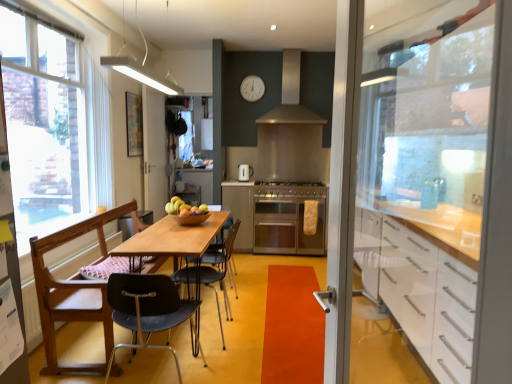
Question: From a real-world perspective, is transparent glass screen door at center, the 2th screen door in the front-to-back sequence, on clear glass window at left?

Choices:
 (A) no
 (B) yes

Answer: (A)

Question: From the image's perspective, is transparent glass screen door at center, the second screen door positioned from the right, over clear glass window at left?

Choices:
 (A) yes
 (B) no

Answer: (B)

Question: Is transparent glass screen door at center, the second screen door positioned from the right, positioned in front of clear glass window at left?

Choices:
 (A) no
 (B) yes

Answer: (A)

Question: Considering the relative sizes of transparent glass screen door at center, the 2th screen door in the front-to-back sequence, and clear glass window at left in the image provided, is transparent glass screen door at center, the 2th screen door in the front-to-back sequence, bigger than clear glass window at left?

Choices:
 (A) no
 (B) yes

Answer: (A)

Question: Is the depth of transparent glass screen door at center, acting as the first screen door starting from the back, greater than that of clear glass window at left?

Choices:
 (A) no
 (B) yes

Answer: (B)

Question: Considering the positions of point (243, 89) and point (86, 188), is point (243, 89) closer or farther from the camera than point (86, 188)?

Choices:
 (A) closer
 (B) farther

Answer: (B)

Question: Considering their positions, is white plastic clock at upper center located in front of or behind clear glass window at left?

Choices:
 (A) behind
 (B) front

Answer: (A)

Question: From their relative heights in the image, would you say white plastic clock at upper center is taller or shorter than clear glass window at left?

Choices:
 (A) short
 (B) tall

Answer: (A)

Question: From a real-world perspective, relative to clear glass window at left, is white plastic clock at upper center vertically above or below?

Choices:
 (A) below
 (B) above

Answer: (B)

Question: Is point (186, 208) closer or farther from the camera than point (90, 319)?

Choices:
 (A) farther
 (B) closer

Answer: (A)

Question: Is matte wooden bowl at center to the left or to the right of wooden chair at left, which is counted as the 2th chair, starting from the back, in the image?

Choices:
 (A) right
 (B) left

Answer: (A)

Question: Is matte wooden bowl at center wider or thinner than wooden chair at left, which is counted as the second chair, starting from the front?

Choices:
 (A) thin
 (B) wide

Answer: (A)

Question: Would you say matte wooden bowl at center is inside or outside wooden chair at left, which is counted as the 2th chair, starting from the back?

Choices:
 (A) outside
 (B) inside

Answer: (A)

Question: From the image's perspective, relative to matte white cabinet at center, is satin silver gas stove at center above or below?

Choices:
 (A) above
 (B) below

Answer: (A)

Question: In terms of size, does satin silver gas stove at center appear bigger or smaller than matte white cabinet at center?

Choices:
 (A) big
 (B) small

Answer: (B)